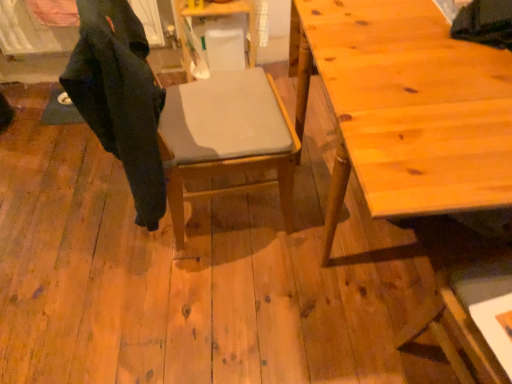
Locate an element on the screen. Image resolution: width=512 pixels, height=384 pixels. free space between matte gray cushion at center and wooden table at right, which is counted as the 2th table, starting from the back is located at coordinates (258, 272).